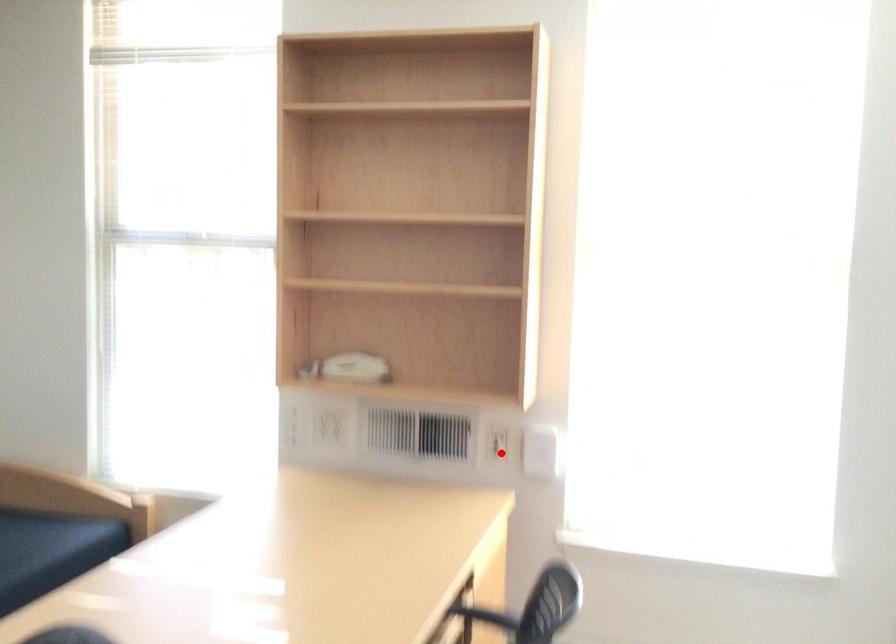
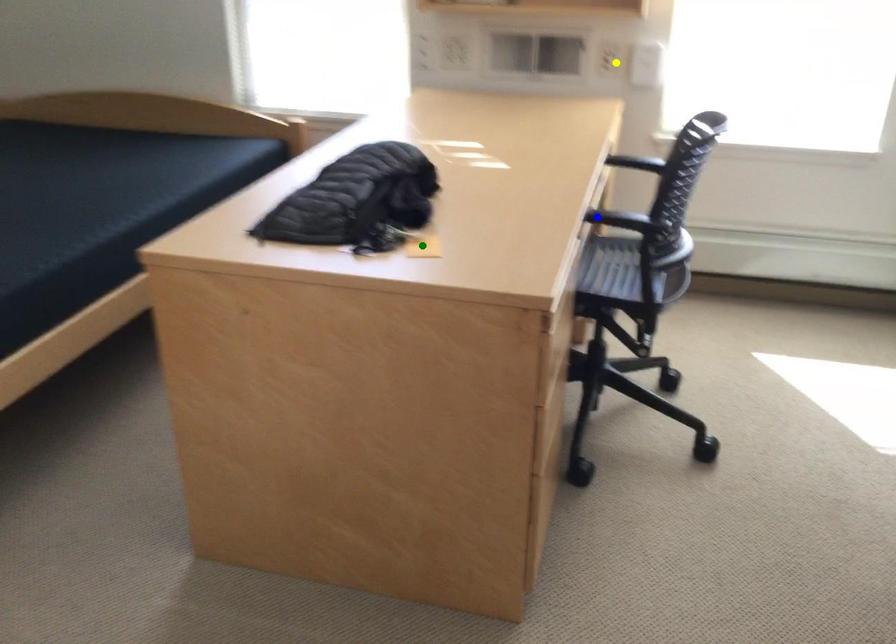
Question: I am providing you with two images of the same scene from different viewpoints. A red point is marked on the first image. You are given multiple points on the second image. Which point in image 2 represents the same 3d spot as the red point in image 1?

Choices:
 (A) blue point
 (B) yellow point
 (C) green point

Answer: (B)